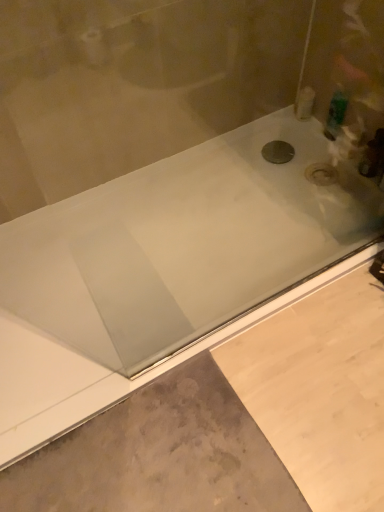
Locate an element on the screen. vacant space situated on the left part of white plastic bottle at upper right, arranged as the first toiletry when viewed from the left is located at coordinates (267, 129).